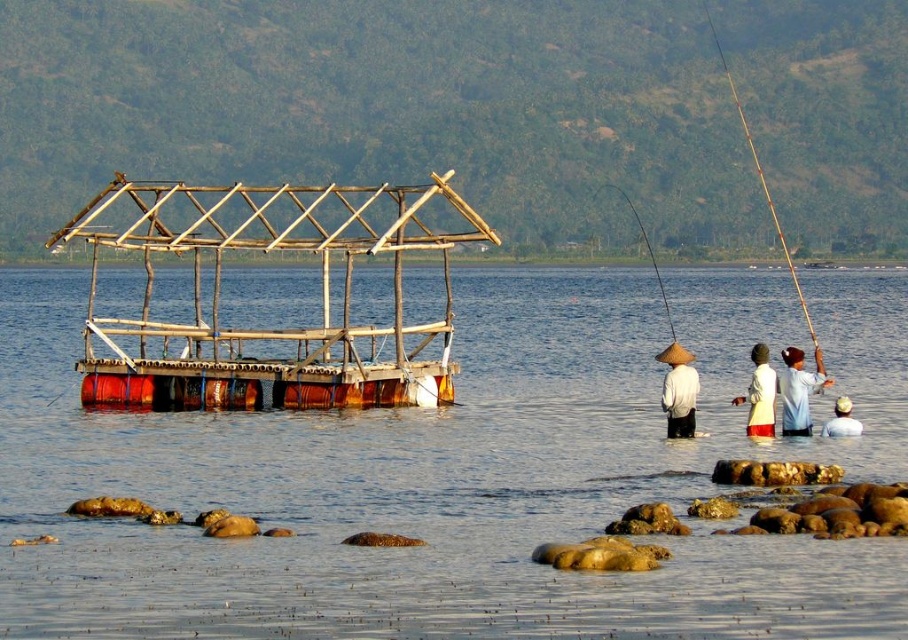
How far apart are transparent wooden structure at center and white cotton hat at lower right?

The distance of transparent wooden structure at center from white cotton hat at lower right is 38.63 meters.

Does point (185, 593) lie in front of point (840, 435)?

That is True.

The height and width of the screenshot is (640, 908). What do you see at coordinates (454, 476) in the screenshot? I see `transparent wooden structure at center` at bounding box center [454, 476].

Find the location of `transparent wooden structure at center`. transparent wooden structure at center is located at coordinates pos(454,476).

Who is higher up, transparent wooden structure at center or natural wood raft at center?

natural wood raft at center is above.

Does transparent wooden structure at center have a greater width compared to natural wood raft at center?

Yes.

Who is more distant from viewer, (455, 536) or (147, 364)?

Point (147, 364)

The image size is (908, 640). What are the coordinates of `transparent wooden structure at center` in the screenshot? It's located at (454, 476).

Does transparent wooden structure at center have a larger size compared to white woven hat at right?

Yes.

Is transparent wooden structure at center above white woven hat at right?

Indeed, transparent wooden structure at center is positioned over white woven hat at right.

Is point (479, 620) positioned in front of point (765, 380)?

Yes, it is in front of point (765, 380).

Identify the location of transparent wooden structure at center. Image resolution: width=908 pixels, height=640 pixels. (454, 476).